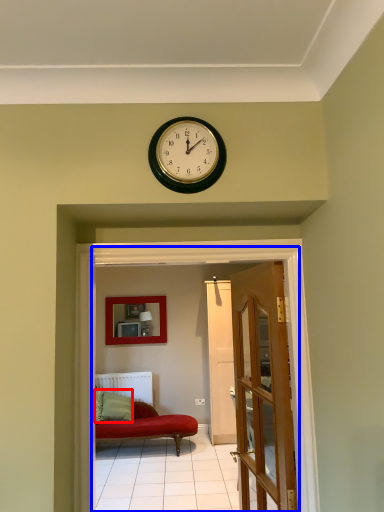
Question: Which point is further to the camera, pillow (highlighted by a red box) or corridor (highlighted by a blue box)?

Choices:
 (A) pillow
 (B) corridor

Answer: (A)